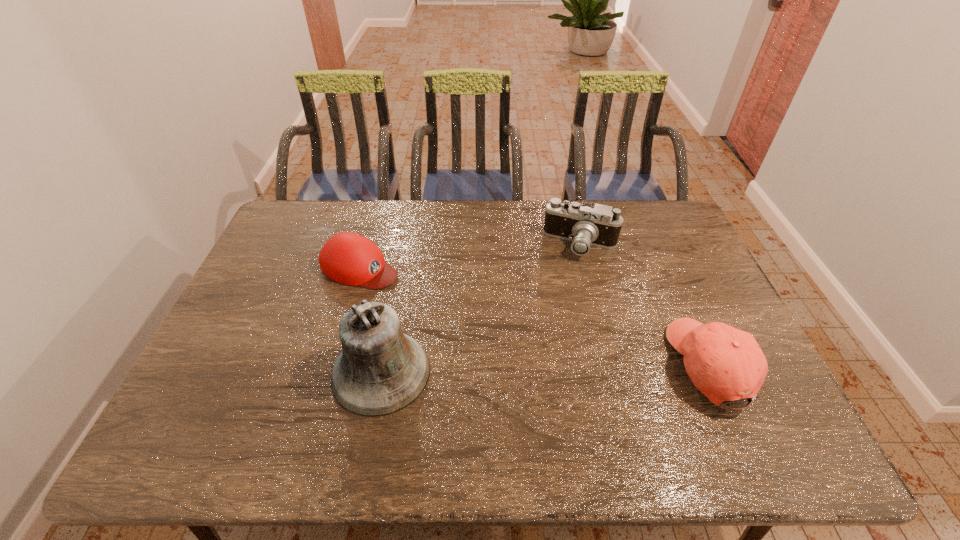
What are the coordinates of `free spot on the desktop that is between the bell and the nearer baseball cap and is positioned on the front-facing side of the left baseball cap` in the screenshot? It's located at (581, 368).

Locate an element on the screen. The width and height of the screenshot is (960, 540). free space on the desktop that is between the bell and the right baseball cap and is positioned at the lens of the camera is located at coordinates (510, 369).